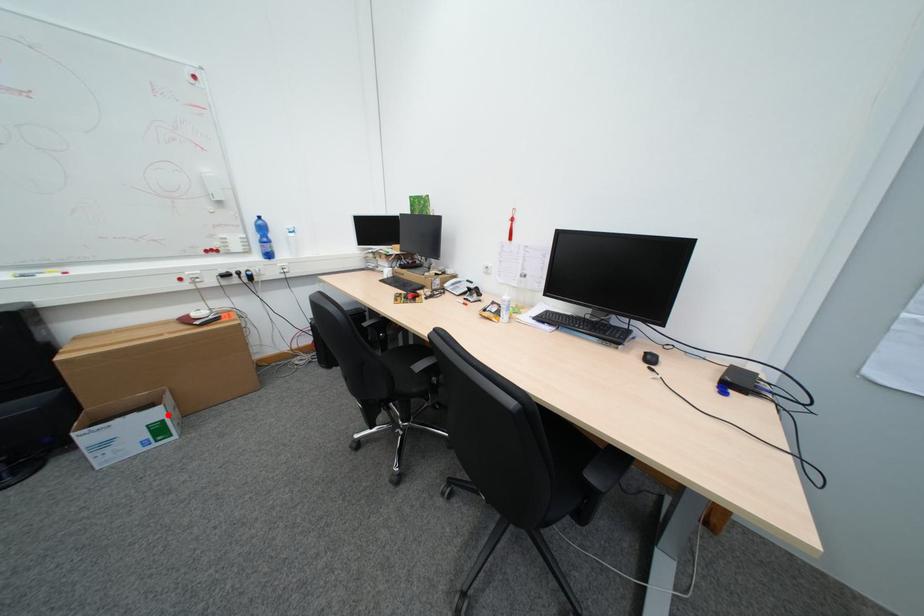
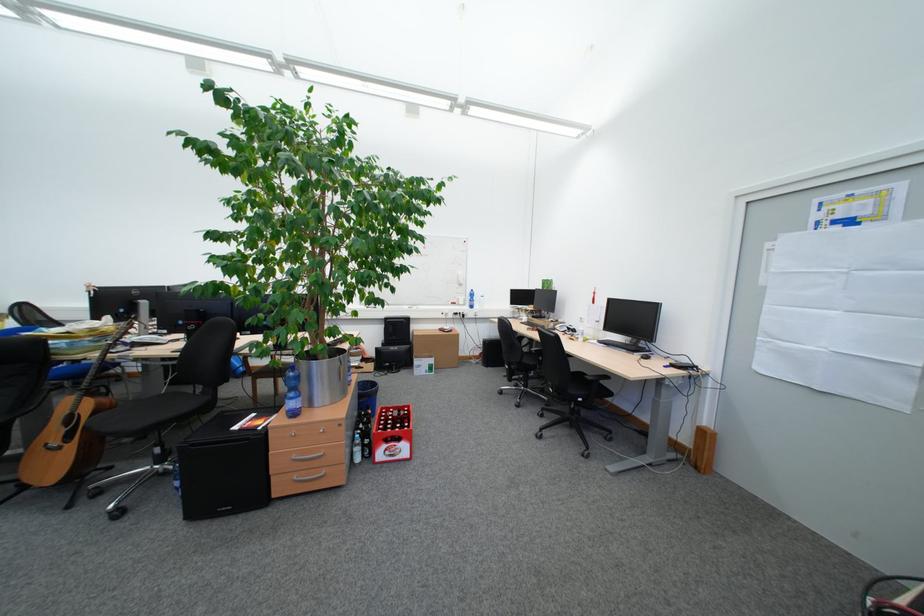
The point at the highlighted location is marked in the first image. Where is the corresponding point in the second image?

(444, 362)